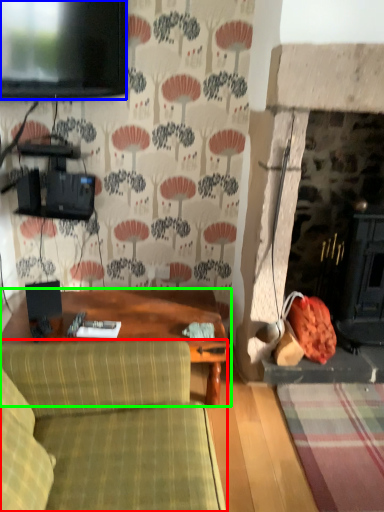
Question: Based on their relative distances, which object is farther from studio couch (highlighted by a red box)? Choose from television (highlighted by a blue box) and table (highlighted by a green box).

Choices:
 (A) television
 (B) table

Answer: (A)